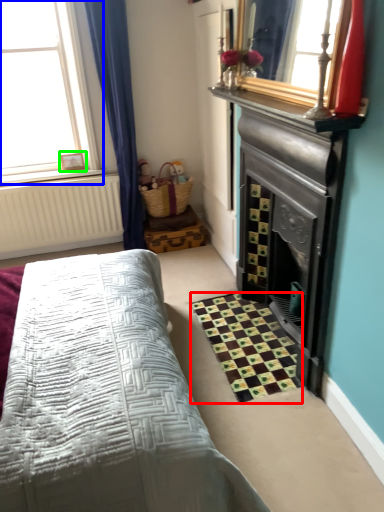
Question: Which object is positioned farthest from pattern (highlighted by a red box)? Select from window (highlighted by a blue box) and picture frame (highlighted by a green box).

Choices:
 (A) window
 (B) picture frame

Answer: (A)